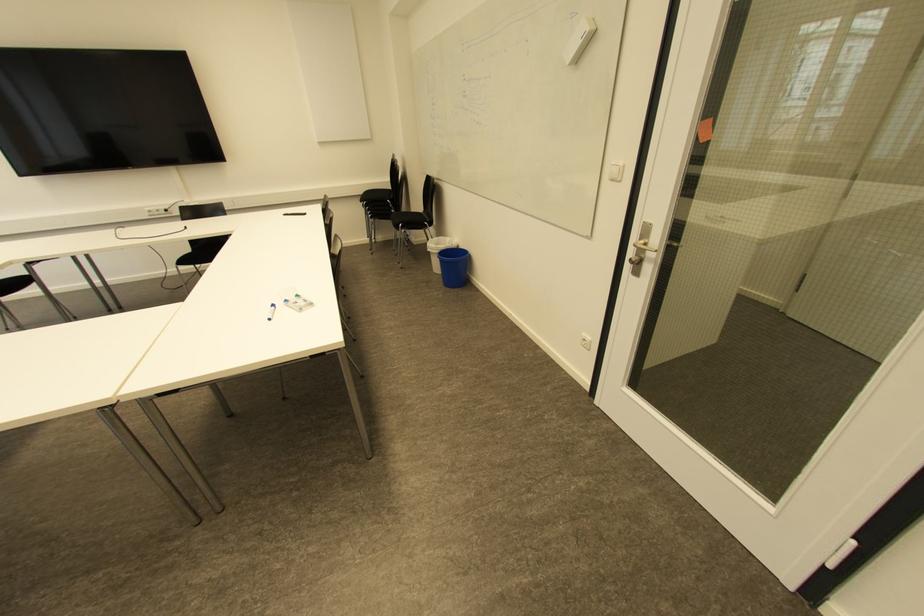
Image resolution: width=924 pixels, height=616 pixels. Identify the location of metal door handle. (640, 248).